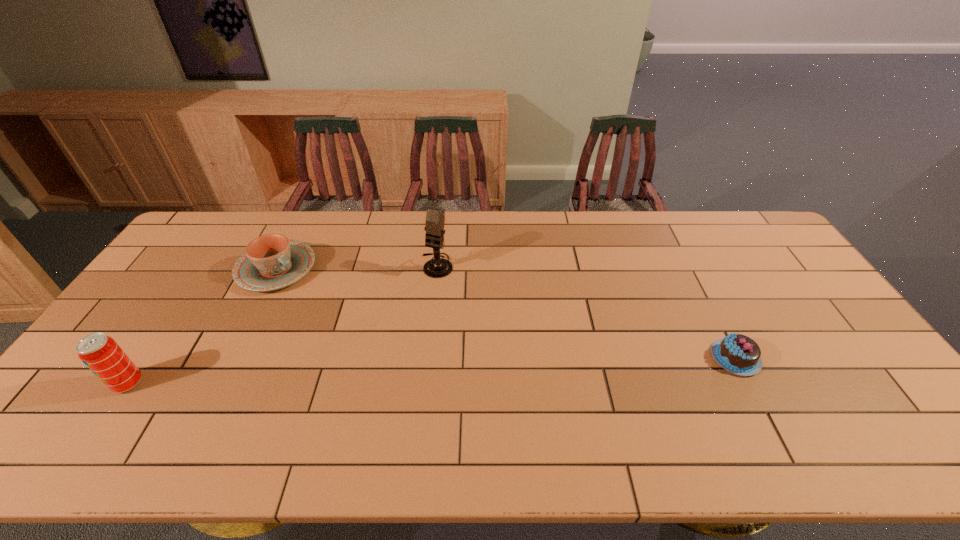
Find the location of a particular element. The width and height of the screenshot is (960, 540). blank area in the image that satisfies the following two spatial constraints: 1. on the back side of the shortest object; 2. on the right side of the soda can is located at coordinates (146, 357).

Where is `free space that satisfies the following two spatial constraints: 1. on the back side of the leftmost object; 2. on the right side of the chocolate cake`? free space that satisfies the following two spatial constraints: 1. on the back side of the leftmost object; 2. on the right side of the chocolate cake is located at coordinates (146, 357).